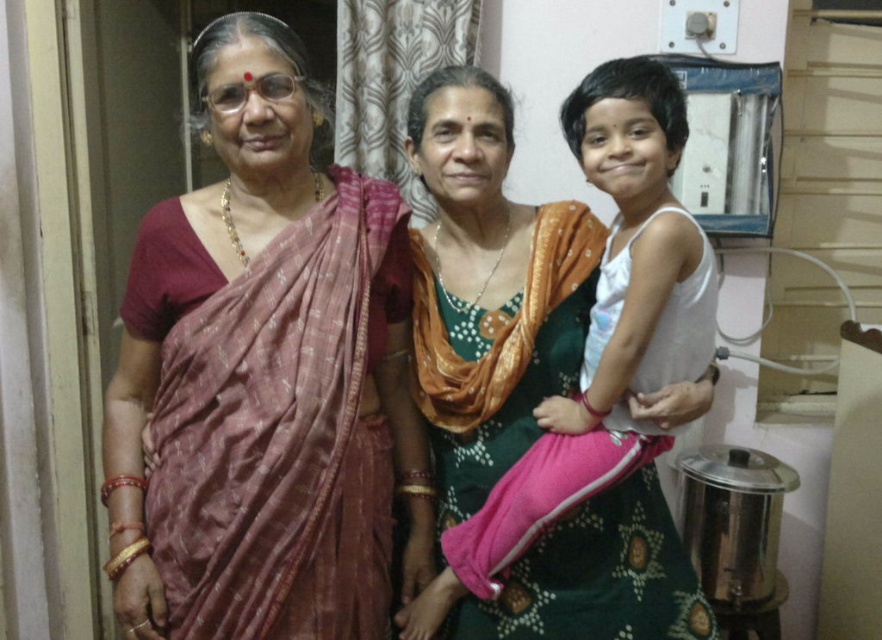
Which of these two, matte pink sari at center or green silk sari at center, stands taller?

matte pink sari at center is taller.

Can you confirm if matte pink sari at center is bigger than green silk sari at center?

Indeed, matte pink sari at center has a larger size compared to green silk sari at center.

Is point (178, 451) closer to viewer compared to point (468, 332)?

Yes, point (178, 451) is closer to viewer.

Where is `matte pink sari at center`? This screenshot has height=640, width=882. matte pink sari at center is located at coordinates (264, 378).